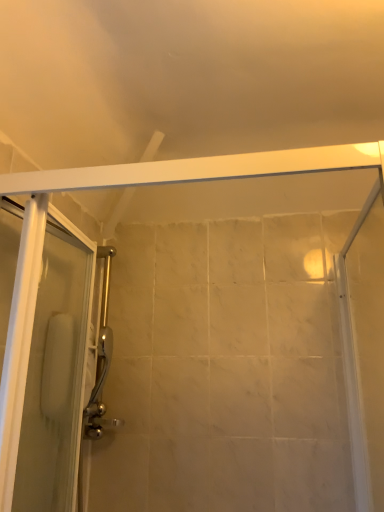
Find the location of a particular element. clear glass shower door at left is located at coordinates (42, 355).

What do you see at coordinates (42, 355) in the screenshot? I see `clear glass shower door at left` at bounding box center [42, 355].

The image size is (384, 512). What are the coordinates of `clear glass shower door at left` in the screenshot? It's located at (42, 355).